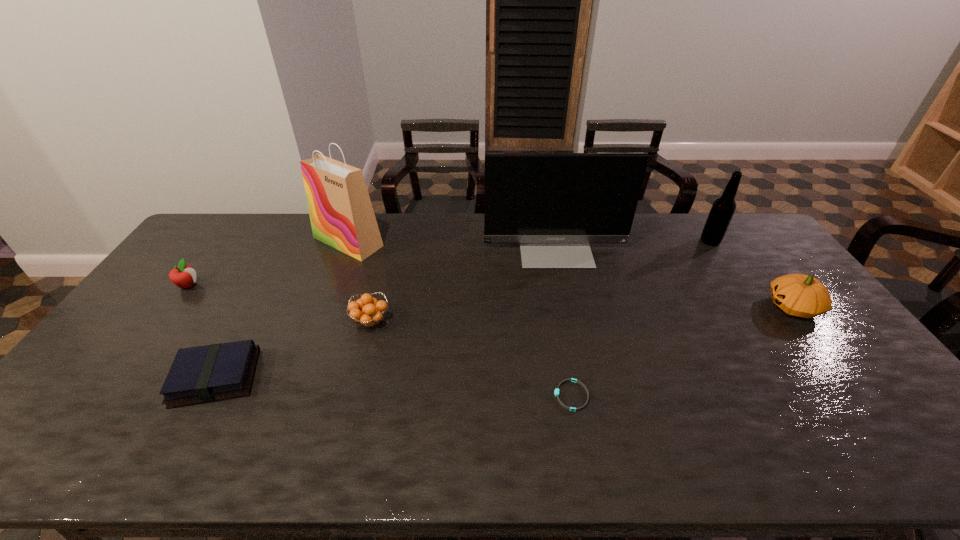
At what (x,y) coordinates should I click in order to perform the action: click on free spot between the beer bottle and the orange fruit. Please return your answer as a coordinate pair (x, y). This screenshot has height=540, width=960. Looking at the image, I should click on (540, 281).

Locate an element on the screen. object that is the fourth closest to the apple is located at coordinates (554, 204).

You are a GUI agent. You are given a task and a screenshot of the screen. Output one action in this format:
    pyautogui.click(x=<x>, y=<y>)
    Task: Click on the object that stands as the closest to the leftmost object
    The height and width of the screenshot is (540, 960).
    Given the screenshot: What is the action you would take?
    pyautogui.click(x=203, y=374)

The height and width of the screenshot is (540, 960). Find the location of `free location that satisfies the following two spatial constraints: 1. on the back side of the third tallest object; 2. on the right side of the second shortest object`. free location that satisfies the following two spatial constraints: 1. on the back side of the third tallest object; 2. on the right side of the second shortest object is located at coordinates (290, 241).

Where is `free location that satisfies the following two spatial constraints: 1. on the back side of the beer bottle; 2. on the right side of the seventh tallest object`? Image resolution: width=960 pixels, height=540 pixels. free location that satisfies the following two spatial constraints: 1. on the back side of the beer bottle; 2. on the right side of the seventh tallest object is located at coordinates (290, 241).